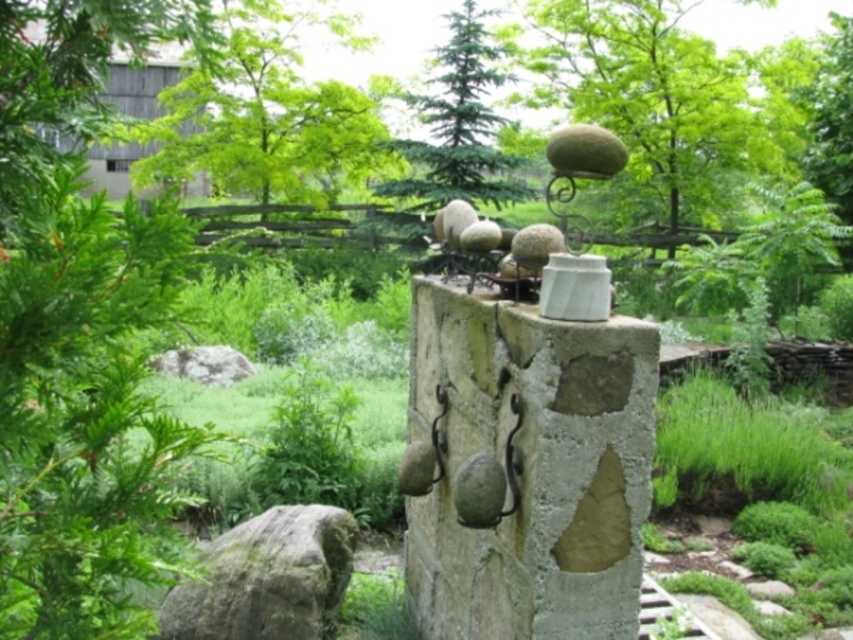
You are standing in the garden and want to take a photo of both the natural stone wall at center and the green leafy tree at upper center. Which object should you position to your left side to include both in the frame?

The natural stone wall at center is to the left of the green leafy tree at upper center, so you should position the natural stone wall at center to your left side to include both in the frame.

You are designing a garden layout and need to know the spatial relationship between the natural stone wall at center and the green leafy tree at upper center. Which of the two has a smaller width?

The natural stone wall at center has a smaller width than the green leafy tree at upper center.

Consider the image. You are a bird looking for a place to perch. You see the green leafy tree at left and the green mossy rock at lower left. Which one is taller?

The green leafy tree at left is much taller than the green mossy rock at lower left, so the tree is taller.